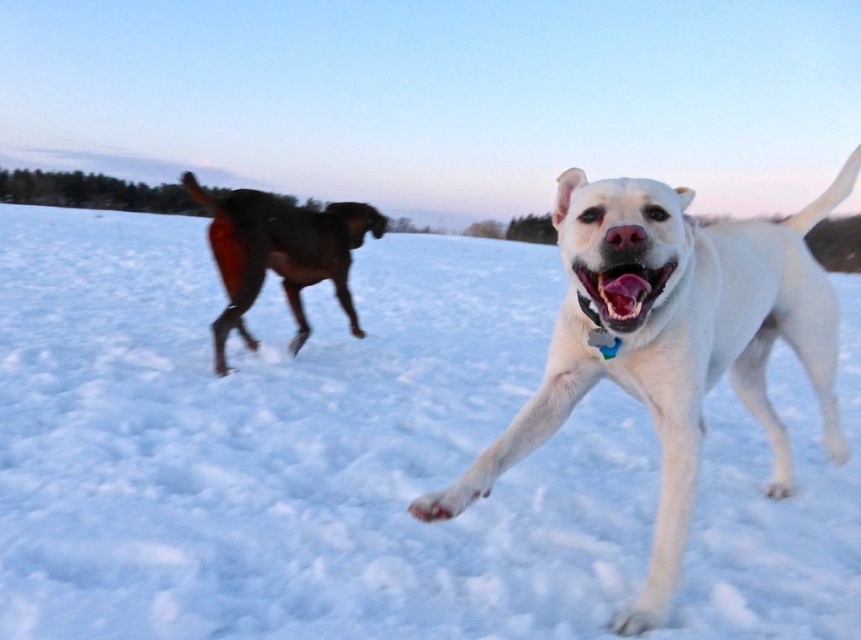
You are a photographer trying to capture a photo of the shiny brown dog at left and the white fluffy snow at center. Based on their widths, which one should you zoom in on to ensure both fit in the frame?

The white fluffy snow at center is wider than the shiny brown dog at left, so you should zoom in on the shiny brown dog at left to ensure both fit in the frame.

You are a dog owner who wants to throw a tennis ball to both dogs. The tennis ball you have can travel up to 10 feet. Can you throw the ball so that both the white glossy dog at center and the shiny brown dog at left can reach it?

The distance between the white glossy dog at center and the shiny brown dog at left is 10.15 feet. Since the tennis ball can only travel up to 10 feet, it cannot cover the entire distance between them. Therefore, you cannot throw the ball so that both dogs can reach it.

You are a photographer trying to capture a photo of the white glossy dog at center. You are standing on the white fluffy snow at center. Can you take a clear photo of the dog without any obstruction?

The white fluffy snow at center is closer to you than the white glossy dog at center, so there might be an obstruction between you and the dog. Move forward or adjust your position to ensure a clear shot.